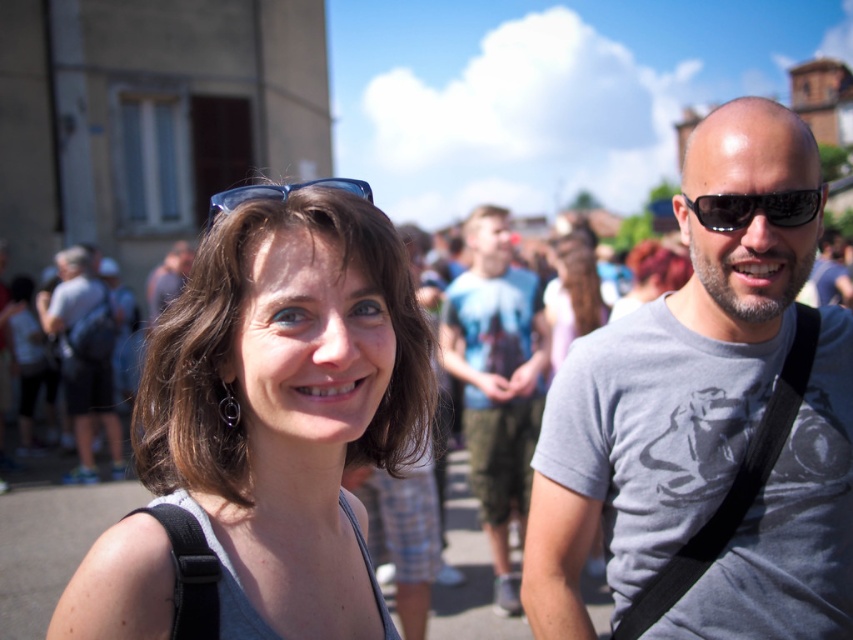
Can you confirm if gray matte t-shirt at right is thinner than blue plastic sunglasses at upper center?

Yes.

Is point (697, 458) positioned behind point (256, 188)?

Yes.

Image resolution: width=853 pixels, height=640 pixels. In order to click on gray matte t-shirt at right in this screenshot , I will do `click(659, 416)`.

Does matte black backpack at left have a greater height compared to black plastic sunglasses at right?

Yes, matte black backpack at left is taller than black plastic sunglasses at right.

Is matte black backpack at left below black plastic sunglasses at right?

Yes.

Between point (77, 451) and point (728, 227), which one is positioned behind?

Point (77, 451)

The image size is (853, 640). I want to click on matte black backpack at left, so click(91, 417).

Between gray matte t-shirt at right and matte black backpack at left, which one is positioned higher?

gray matte t-shirt at right

Looking at this image, between gray matte t-shirt at right and matte black backpack at left, which one has less height?

matte black backpack at left is shorter.

Which is behind, point (759, 502) or point (84, 436)?

Point (84, 436)

Identify the location of gray matte t-shirt at right. The height and width of the screenshot is (640, 853). (659, 416).